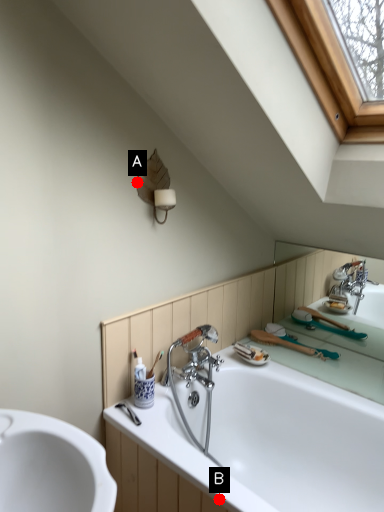
Question: Two points are circled on the image, labeled by A and B beside each circle. Which point appears closest to the camera in this image?

Choices:
 (A) A is closer
 (B) B is closer

Answer: (B)